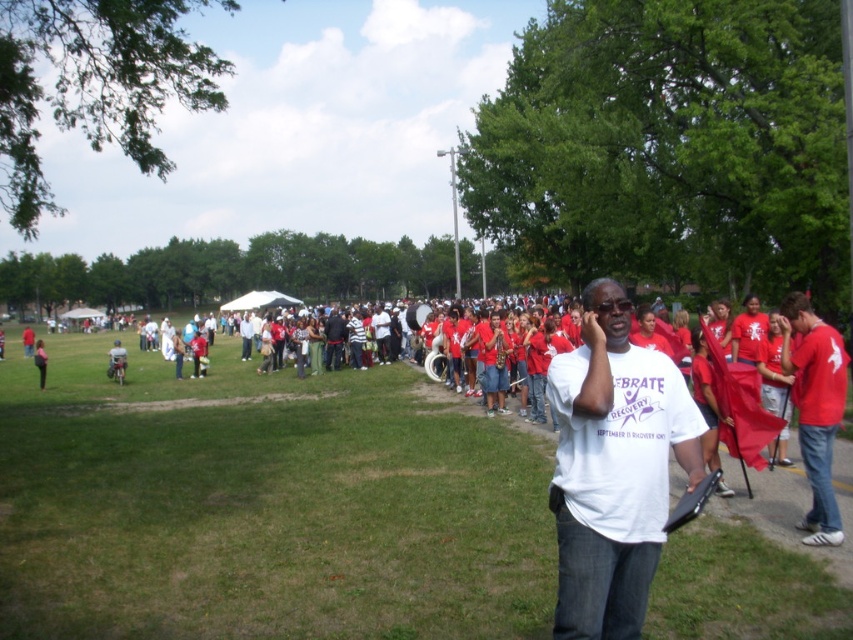
You are standing in the park and see two points marked in the image. The first point is at coordinates point (x=618, y=387) and the second is at point (x=819, y=400). Which point is closer to you?

Point (x=618, y=387) is in front of point (x=819, y=400), so it is closer to you.